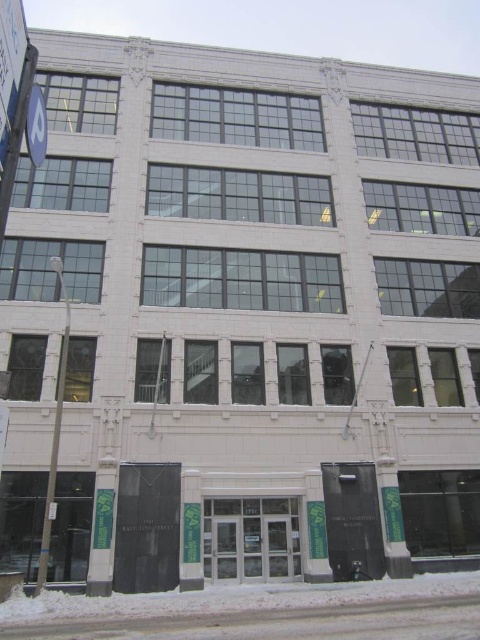
Question: Does white powdery snow at lower center appear on the right side of white plastic parking sign at upper left?

Choices:
 (A) no
 (B) yes

Answer: (B)

Question: Among these objects, which one is farthest from the camera?

Choices:
 (A) white powdery snow at lower center
 (B) white plastic parking sign at upper left

Answer: (A)

Question: Does white powdery snow at lower center appear under white plastic parking sign at upper left?

Choices:
 (A) yes
 (B) no

Answer: (A)

Question: Observing the image, what is the correct spatial positioning of white powdery snow at lower center in reference to white plastic parking sign at upper left?

Choices:
 (A) above
 (B) below

Answer: (B)